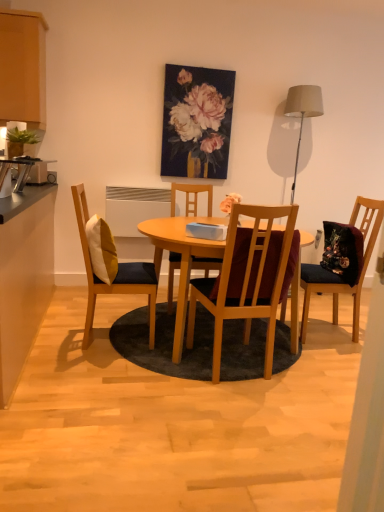
At what (x,y) coordinates should I click in order to perform the action: click on vacant area situated to the left side of yellow and white cushioned chair at left, which appears as the 1th chair when viewed from the left. Please return your answer as a coordinate pair (x, y). The image size is (384, 512). Looking at the image, I should click on 64,327.